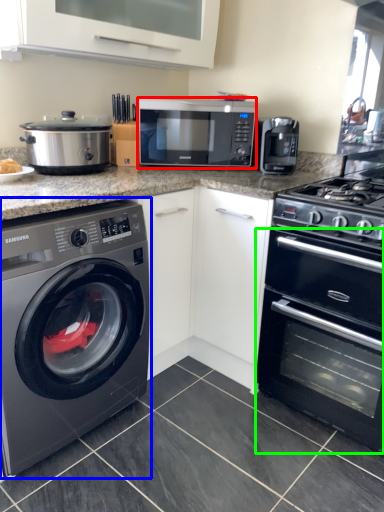
Question: Estimate the real-world distances between objects in this image. Which object is closer to microwave oven (highlighted by a red box), washing machine (highlighted by a blue box) or oven (highlighted by a green box)?

Choices:
 (A) washing machine
 (B) oven

Answer: (B)